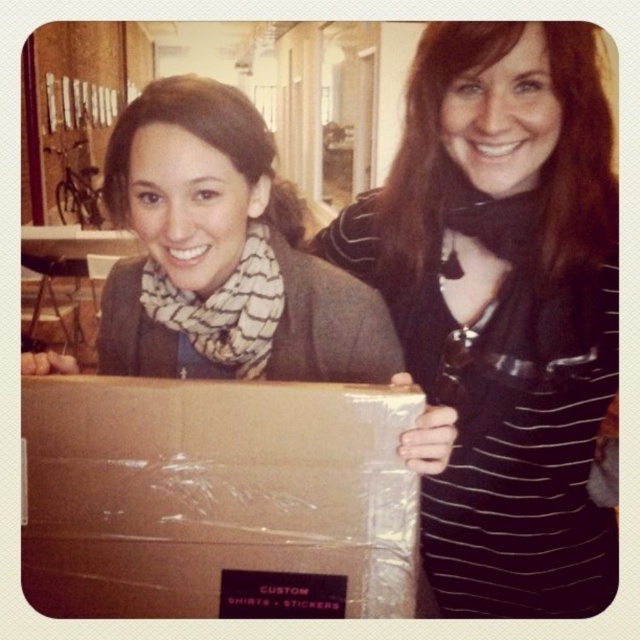
Question: Is black striped shirt at center thinner than brown cardboard box at center?

Choices:
 (A) no
 (B) yes

Answer: (A)

Question: Which point appears farthest from the camera in this image?

Choices:
 (A) click(x=499, y=520)
 (B) click(x=77, y=573)

Answer: (A)

Question: Can you confirm if black striped shirt at center is wider than brown cardboard box at center?

Choices:
 (A) no
 (B) yes

Answer: (B)

Question: Is black striped shirt at center wider than brown cardboard box at center?

Choices:
 (A) no
 (B) yes

Answer: (B)

Question: Which point is closer to the camera?

Choices:
 (A) brown cardboard box at center
 (B) black striped shirt at center

Answer: (A)